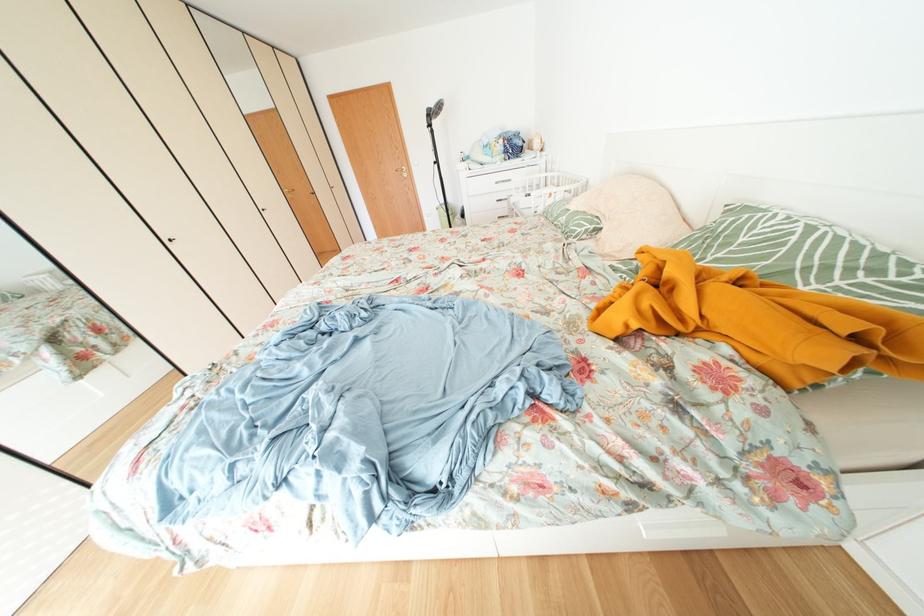
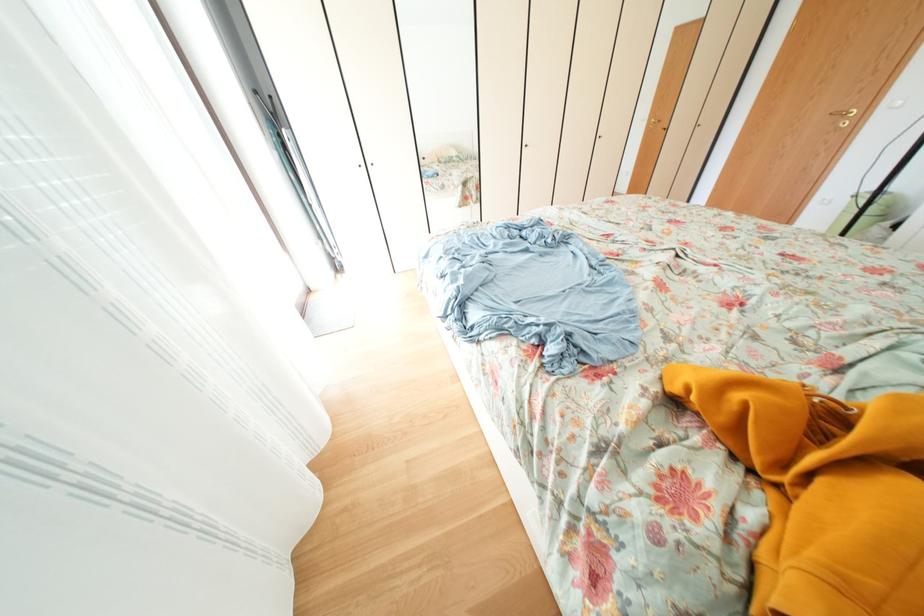
From the picture: Based on the continuous images, in which direction is the camera rotating?

The camera rotated toward left-down.